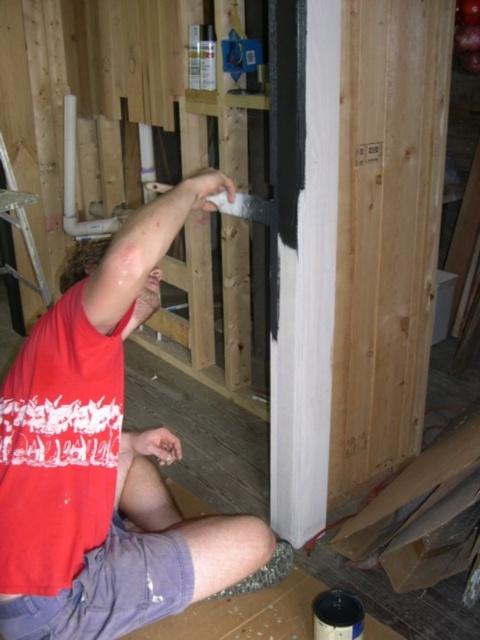
Consider the image. Is matte red t-shirt at upper left to the right of silver metallic ladder at left from the viewer's perspective?

Yes, matte red t-shirt at upper left is to the right of silver metallic ladder at left.

Is matte red t-shirt at upper left positioned at the back of silver metallic ladder at left?

No, matte red t-shirt at upper left is in front of silver metallic ladder at left.

I want to click on matte red t-shirt at upper left, so click(103, 461).